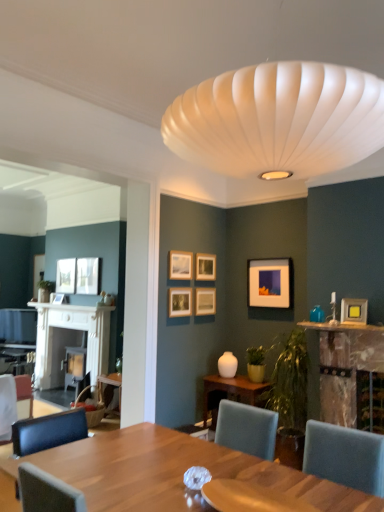
Question: Is white wood fireplace at left, which is counted as the first fireplace, starting from the left, to the left or to the right of rustic wood fireplace at right, marked as the 2th fireplace in a left-to-right arrangement, in the image?

Choices:
 (A) left
 (B) right

Answer: (A)

Question: Considering the positions of white wood fireplace at left, arranged as the 2th fireplace when viewed from the right, and rustic wood fireplace at right, which is the 2th fireplace from back to front, in the image, is white wood fireplace at left, arranged as the 2th fireplace when viewed from the right, wider or thinner than rustic wood fireplace at right, which is the 2th fireplace from back to front,?

Choices:
 (A) thin
 (B) wide

Answer: (B)

Question: Which of these objects is positioned closest to the matte white picture frame at upper left, the 7th picture frame viewed from the front?

Choices:
 (A) rustic wood fireplace at right, marked as the 2th fireplace in a left-to-right arrangement
 (B) wooden table at center
 (C) wooden armchair at lower left
 (D) matte wooden picture frame at upper center, which is the 7th picture frame from left to right
 (E) teal glass vase at upper right

Answer: (C)

Question: Based on their relative distances, which object is farther from the wooden table at center?

Choices:
 (A) matte yellow picture frame at upper right, which is the first picture frame in front-to-back order
 (B) matte black picture frame at upper left, the second picture frame positioned from the back
 (C) matte black picture frame at center, positioned as the second picture frame in front-to-back order
 (D) rustic wood fireplace at right, marked as the 2th fireplace in a left-to-right arrangement
 (E) matte black picture frame at left, placed as the 9th picture frame when sorted from front to back

Answer: (B)